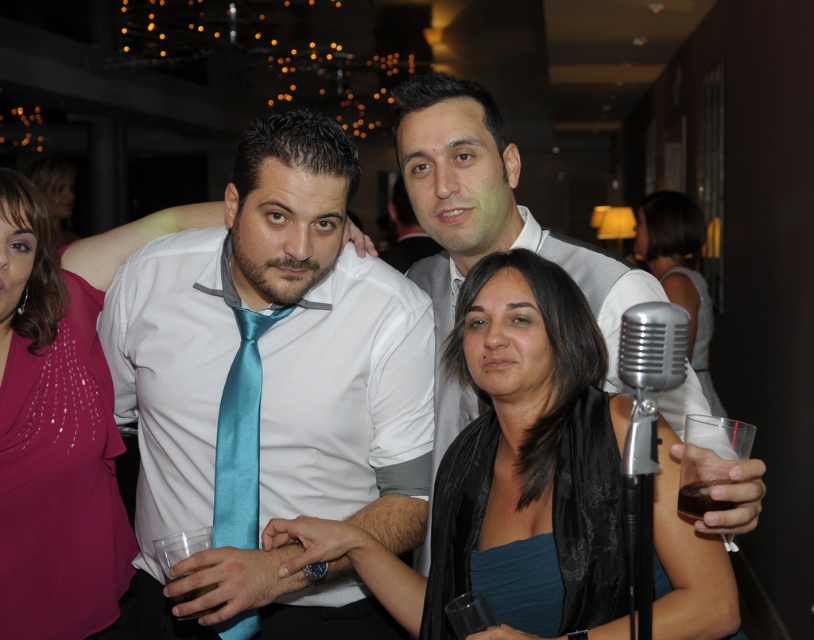
Is teal satin tie at center shorter than matte black microphone at right?

Yes.

Is teal satin tie at center above matte black microphone at right?

Incorrect, teal satin tie at center is not positioned above matte black microphone at right.

Between point (254, 616) and point (674, 285), which one is positioned in front?

Point (254, 616) is more forward.

Where is `teal satin tie at center`? teal satin tie at center is located at coordinates (239, 435).

Who is taller, teal satin scarf at center or matte black microphone at right?

With more height is matte black microphone at right.

Does teal satin scarf at center have a greater height compared to matte black microphone at right?

No, teal satin scarf at center is not taller than matte black microphone at right.

Who is more forward, (x=554, y=547) or (x=667, y=225)?

Point (x=554, y=547) is more forward.

This screenshot has height=640, width=814. What are the coordinates of `teal satin scarf at center` in the screenshot? It's located at (511, 464).

Is point (23, 316) farther from camera compared to point (709, 400)?

No, it is not.

Does shiny pink blouse at center appear on the right side of matte black microphone at right?

Incorrect, shiny pink blouse at center is not on the right side of matte black microphone at right.

The height and width of the screenshot is (640, 814). Describe the element at coordinates (55, 442) in the screenshot. I see `shiny pink blouse at center` at that location.

This screenshot has width=814, height=640. I want to click on shiny pink blouse at center, so [x=55, y=442].